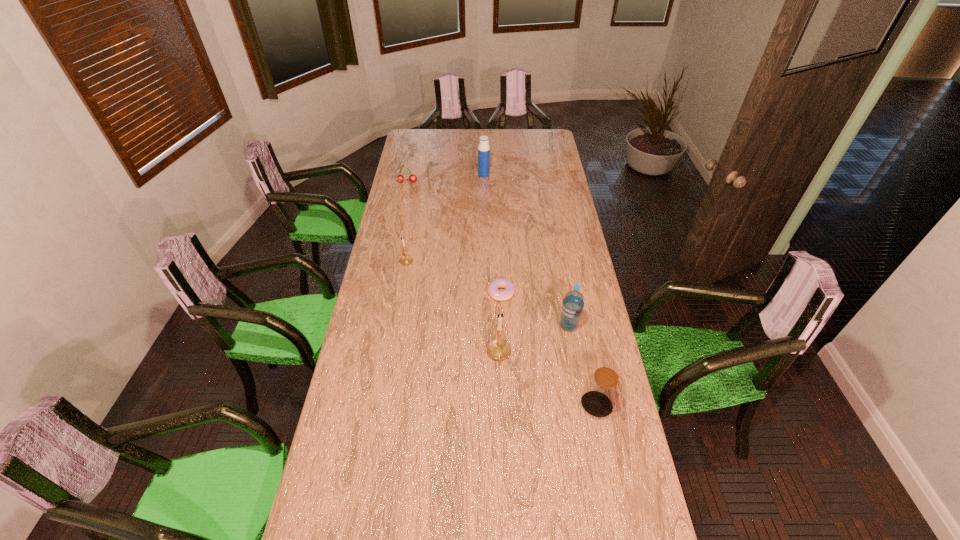
Image resolution: width=960 pixels, height=540 pixels. I want to click on vacant area that lies between the fifth nearest object and the second shortest object, so click(407, 221).

Where is `empty location between the farther water bottle and the shortest object`? The width and height of the screenshot is (960, 540). empty location between the farther water bottle and the shortest object is located at coordinates (492, 234).

Where is `unoccupied position between the farthest object and the fourth shortest object`? Image resolution: width=960 pixels, height=540 pixels. unoccupied position between the farthest object and the fourth shortest object is located at coordinates (540, 290).

This screenshot has width=960, height=540. I want to click on unoccupied position between the farther water bottle and the farther candle holder, so click(x=445, y=218).

Find the location of `vacant area that lies between the nearest object and the farthest object`. vacant area that lies between the nearest object and the farthest object is located at coordinates (540, 290).

I want to click on free area in between the shortest object and the third nearest object, so click(x=535, y=309).

You are a GUI agent. You are given a task and a screenshot of the screen. Output one action in this format:
    pyautogui.click(x=<x>, y=<y>)
    Task: Click on the free space between the fourth tallest object and the farther water bottle
    The image size is (960, 540).
    Given the screenshot: What is the action you would take?
    pyautogui.click(x=540, y=290)

I want to click on vacant region between the right candle holder and the right water bottle, so click(x=534, y=340).

Find the location of a particular element. free space between the nearer candle holder and the shorter candle holder is located at coordinates (453, 307).

Locate an element on the screen. object identified as the second closest to the farther candle holder is located at coordinates (499, 349).